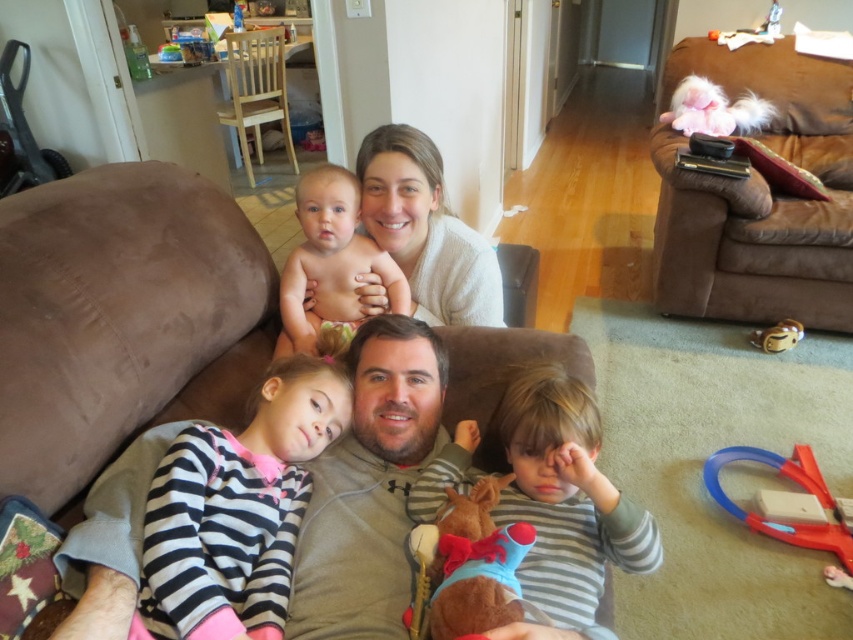
Question: Which object is farther from the camera taking this photo?

Choices:
 (A) nude skin baby at upper center
 (B) black striped shirt at center

Answer: (A)

Question: Which object is the closest to the velvet plush toy at lower center?

Choices:
 (A) blue plastic train at lower right
 (B) fluffy pink plush at upper right

Answer: (A)

Question: Which object is closer to the camera taking this photo?

Choices:
 (A) gray fleece at center
 (B) white soft sweater at upper center
 (C) black striped shirt at center

Answer: (C)

Question: Can you confirm if striped cotton shirt at lower right is positioned above nude skin baby at upper center?

Choices:
 (A) yes
 (B) no

Answer: (B)

Question: Does brown fabric couch at center appear under blue plastic train at lower right?

Choices:
 (A) yes
 (B) no

Answer: (B)

Question: Can you confirm if blue plastic train at lower right is smaller than matte gold ring at lower right?

Choices:
 (A) yes
 (B) no

Answer: (B)